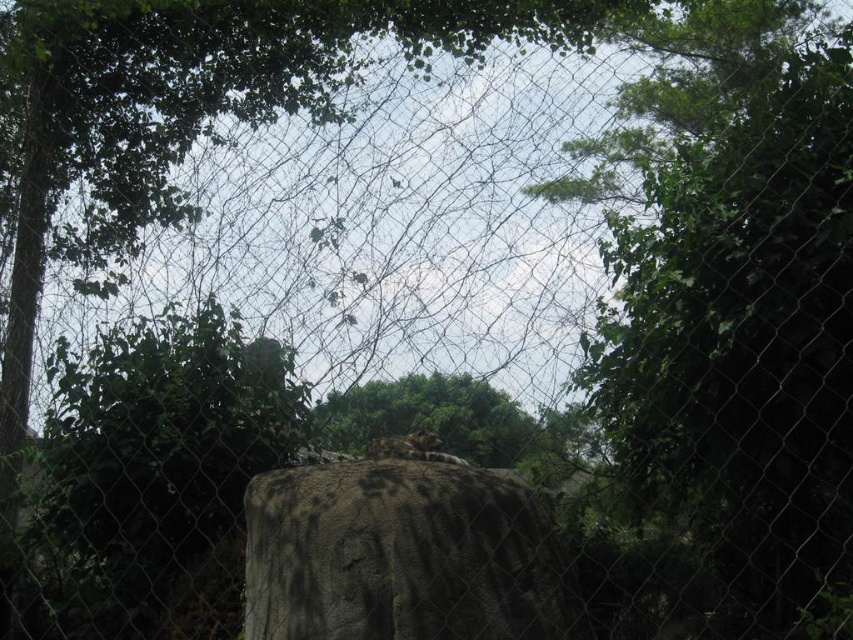
You are a park ranger trying to assess the visibility of the zoo enclosure. Given that the green leafy tree at upper center and the rough textured stone at center are in your line of sight, which object is wider? Please answer based on their widths.

The green leafy tree at upper center is narrower than the rough textured stone at center because the green leafy tree at upper center has a smaller width compared to the rough textured stone at center.

You are a zookeeper trying to determine if the green leafy tree at upper center and the brown fur tiger at center can both fit in a photo frame. The frame is designed to accommodate the larger of the two. Which object should you focus on to ensure both fit?

The green leafy tree at upper center is larger than the brown fur tiger at center. To ensure both fit in the frame, focus on capturing the green leafy tree at upper center since the frame can accommodate its size, allowing the smaller brown fur tiger at center to also fit within the same frame.

Looking at this image, you are a zookeeper trying to place a new feeding tray between the green leafy tree at upper center and the rough textured stone at center. The feeding tray requires 3 feet of space to be placed safely. Can you fit it between them?

The green leafy tree at upper center and rough textured stone at center are 34.04 inches apart. Since 34.04 inches is approximately 2.84 feet, which is less than the required 3 feet, the feeding tray cannot be placed safely between them.